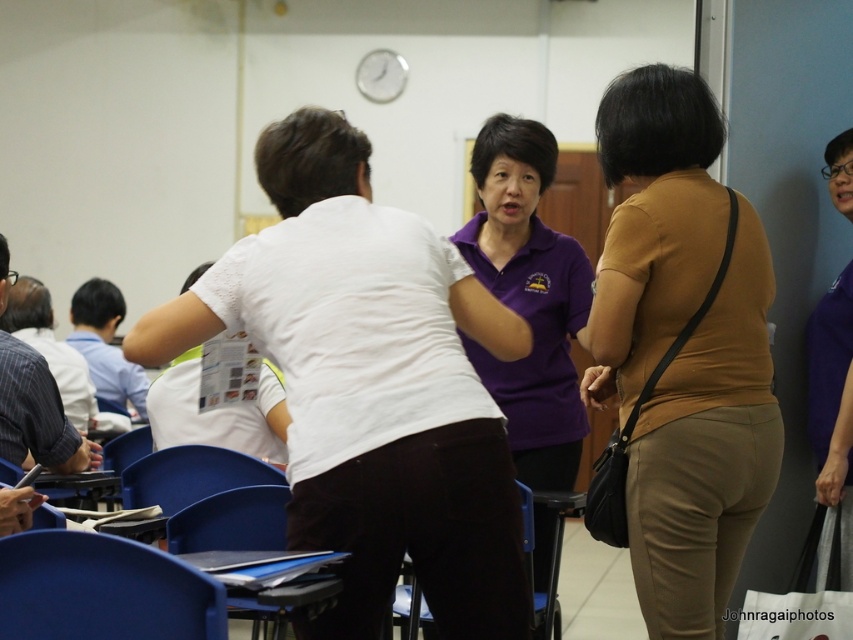
You are a person with a 70 cm wide wheelchair. You want to move between the blue plastic chair at lower left and the blue plastic chair at lower center. Can you fit through the space between them?

The blue plastic chair at lower left and blue plastic chair at lower center are 78.03 centimeters apart. Since your wheelchair is 70 cm wide, you can fit through the space between them as 70 cm is less than 78.03 cm.

You are organizing a classroom event and need to place a white fabric shopping bag at lower right on a blue plastic chair at lower center. Will the bag fit on the chair without falling off?

The blue plastic chair at lower center is shorter than the white fabric shopping bag at lower right. Since the chair is shorter, the bag might not have enough space to rest securely and could potentially fall off.

You are standing in the classroom and need to place a small plant between the blue plastic chair at lower left and the white fabric shopping bag at lower right. Based on their positions, which object should the plant be closer to?

The blue plastic chair at lower left is closer to the viewer than the white fabric shopping bag at lower right, so the plant should be placed closer to the blue plastic chair at lower left to maintain equal distance from both objects.